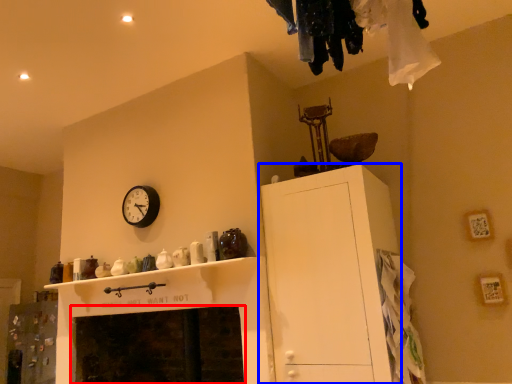
Question: Which object appears closest to the camera in this image, fireplace (highlighted by a red box) or cabinetry (highlighted by a blue box)?

Choices:
 (A) fireplace
 (B) cabinetry

Answer: (B)